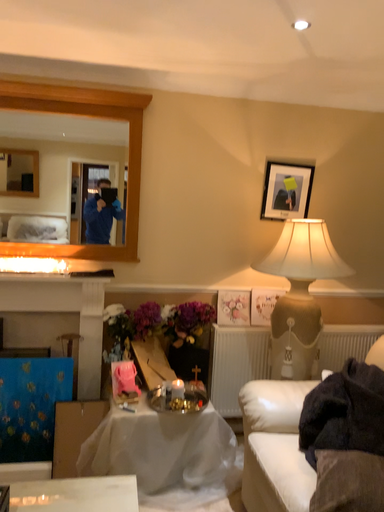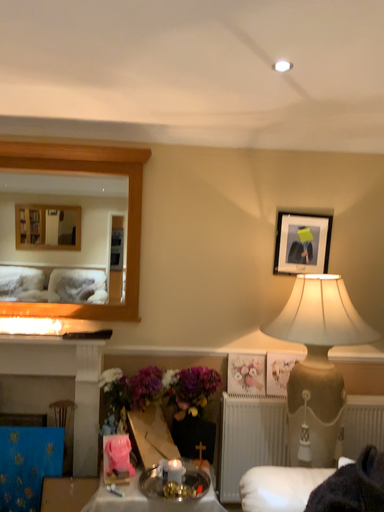
Question: How did the camera likely rotate when shooting the video?

Choices:
 (A) rotated upward
 (B) rotated downward

Answer: (A)